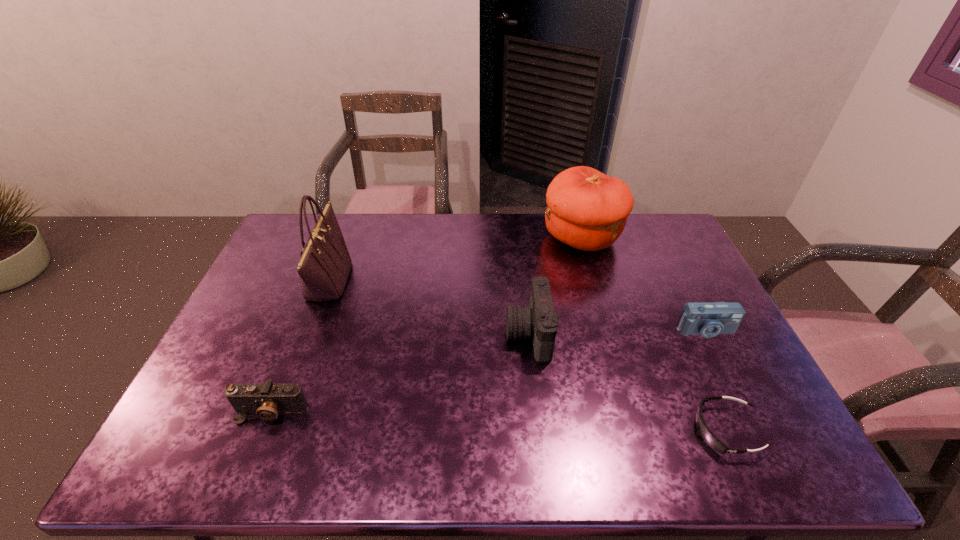
Locate an element on the screen. vacant area between the tallest camera and the goggles is located at coordinates (627, 382).

Where is `free space between the goggles and the fourth shortest object`? The width and height of the screenshot is (960, 540). free space between the goggles and the fourth shortest object is located at coordinates (627, 382).

The image size is (960, 540). Find the location of `vacant space that is in between the handbag and the rightmost camera`. vacant space that is in between the handbag and the rightmost camera is located at coordinates (516, 306).

Where is `unoccupied position between the nearest camera and the handbag`? Image resolution: width=960 pixels, height=540 pixels. unoccupied position between the nearest camera and the handbag is located at coordinates (300, 346).

The width and height of the screenshot is (960, 540). I want to click on vacant region between the tallest object and the shortest object, so click(527, 355).

Find the location of a particular element. Image resolution: width=960 pixels, height=540 pixels. vacant space that's between the handbag and the goggles is located at coordinates (527, 355).

Find the location of a particular element. This screenshot has width=960, height=540. free point between the shortest object and the second camera from left to right is located at coordinates (627, 382).

The width and height of the screenshot is (960, 540). I want to click on vacant area that lies between the rightmost camera and the goggles, so pyautogui.click(x=715, y=380).

You are a GUI agent. You are given a task and a screenshot of the screen. Output one action in this format:
    pyautogui.click(x=<x>, y=<y>)
    Task: Click on the free space between the nearest camera and the goggles
    The image size is (960, 540).
    Given the screenshot: What is the action you would take?
    pyautogui.click(x=498, y=421)

This screenshot has height=540, width=960. What are the coordinates of `object that ranks as the fifth closest to the tallest object` in the screenshot? It's located at (708, 319).